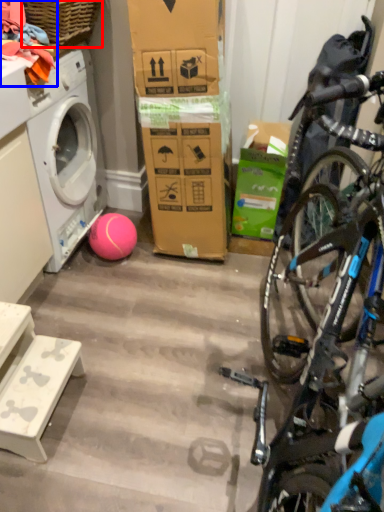
Question: Which object appears closest to the camera in this image, picnic basket (highlighted by a red box) or clothing (highlighted by a blue box)?

Choices:
 (A) picnic basket
 (B) clothing

Answer: (B)